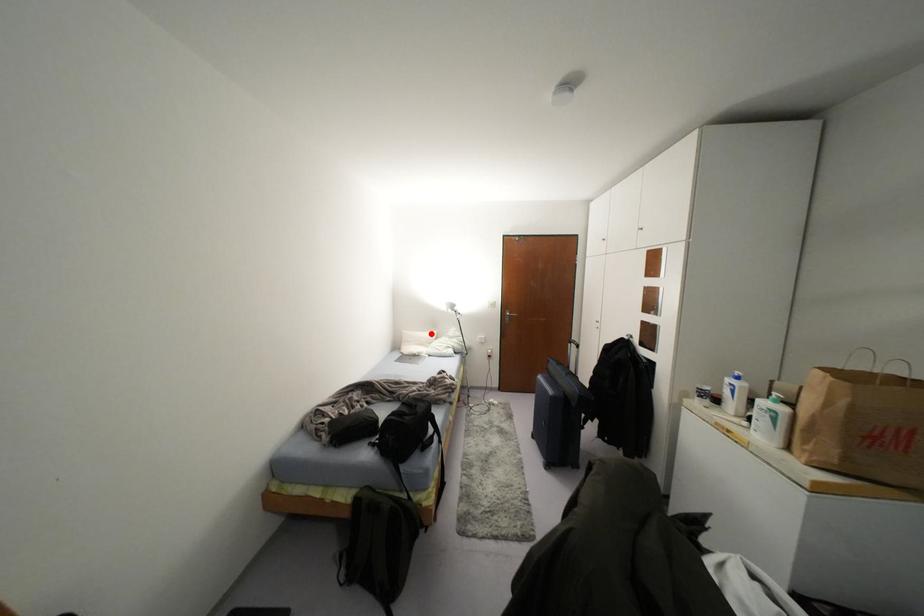
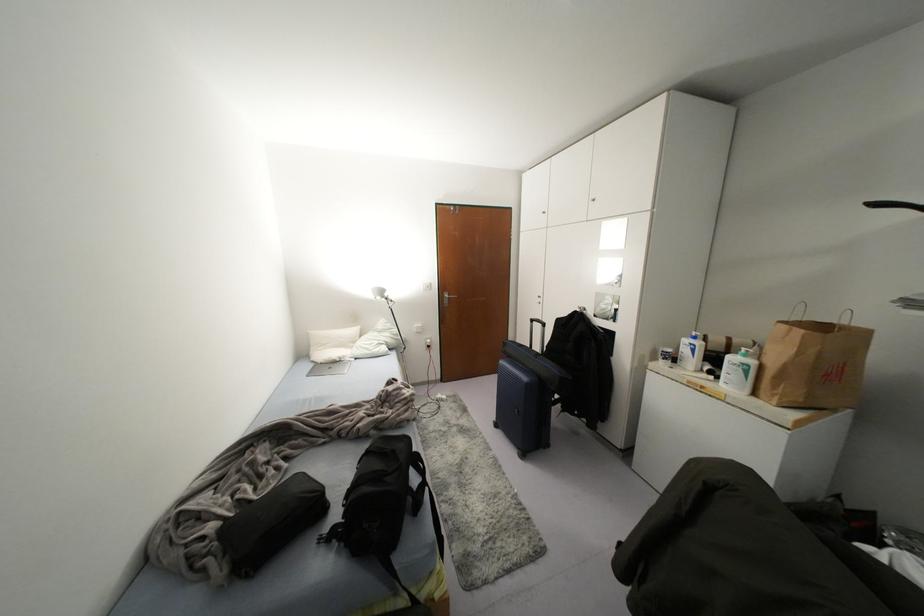
Question: I am providing you with two images of the same scene from different viewpoints. A red point is shown in image1. For the corresponding object point in image2, is it positioned nearer or farther from the camera?

Choices:
 (A) Nearer
 (B) Farther

Answer: (A)